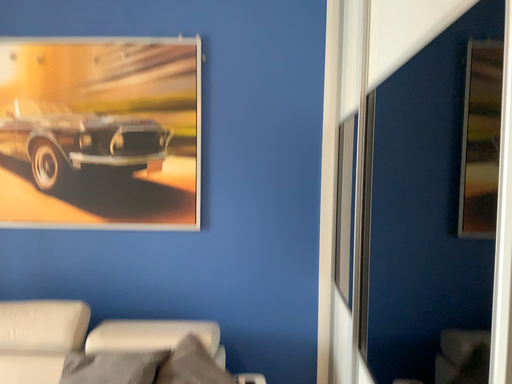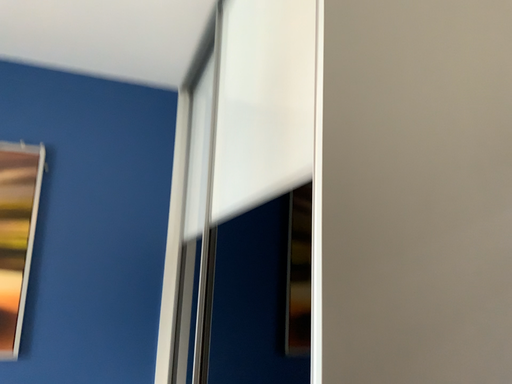
Question: Which way did the camera rotate in the video?

Choices:
 (A) rotated right
 (B) rotated left

Answer: (A)